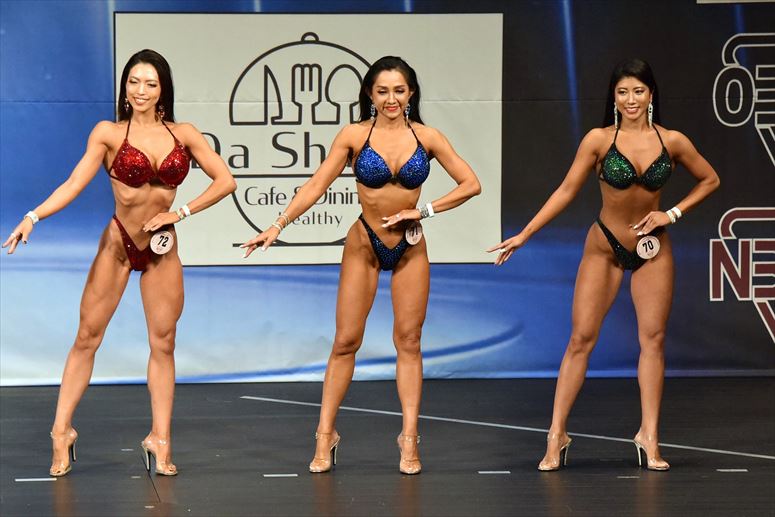
Identify the location of stage. (381, 499).